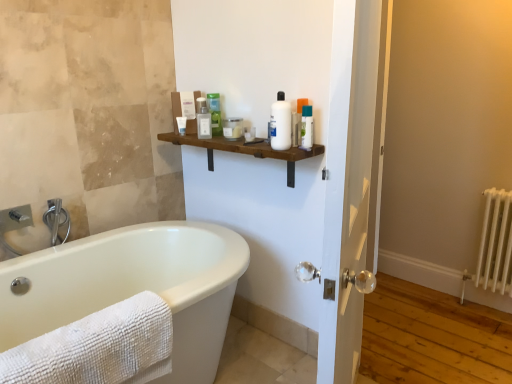
Locate an element on the screen. free space on the front side of white metallic radiator at right is located at coordinates (488, 332).